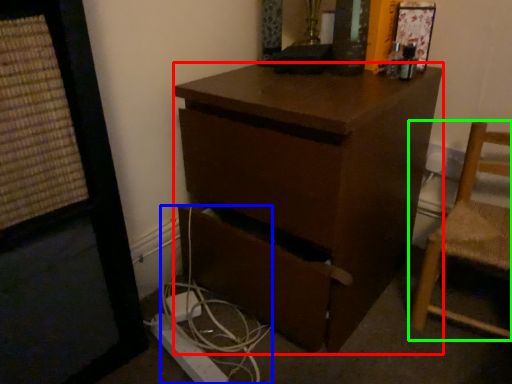
Question: Based on their relative distances, which object is farther from desk (highlighted by a red box)? Choose from cable (highlighted by a blue box) and chair (highlighted by a green box).

Choices:
 (A) cable
 (B) chair

Answer: (B)